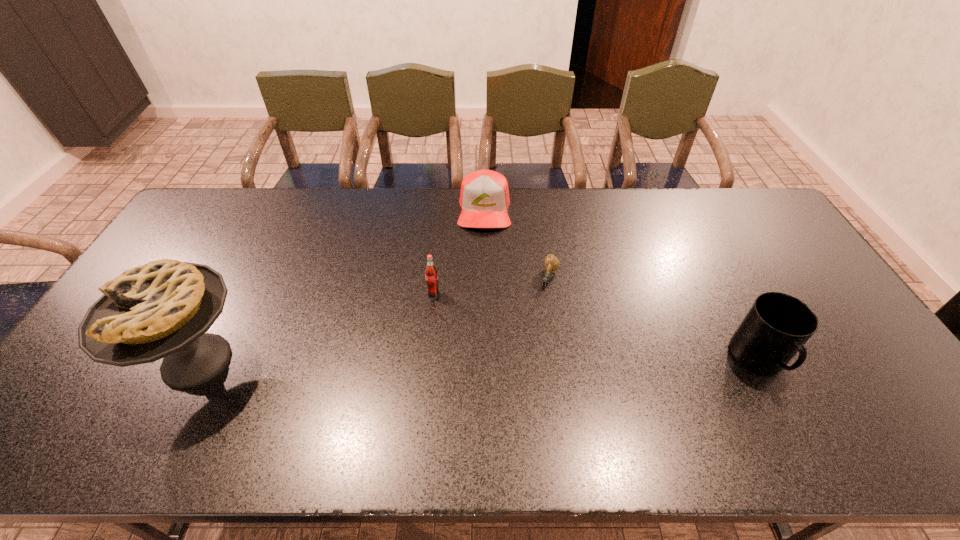
Point out which object is positioned as the nearest to the third object from right to left. Please provide its 2D coordinates. Your answer should be formatted as a tuple, i.e. [(x, y)], where the tuple contains the x and y coordinates of a point satisfying the conditions above.

[(551, 262)]

Identify which object is the nearest to the rightmost object. Please provide its 2D coordinates. Your answer should be formatted as a tuple, i.e. [(x, y)], where the tuple contains the x and y coordinates of a point satisfying the conditions above.

[(551, 262)]

Identify the location of free space that satisfies the following two spatial constraints: 1. on the back side of the escargot; 2. on the left side of the second object from left to right. This screenshot has height=540, width=960. (436, 278).

Find the location of `vacant space that satisfies the following two spatial constraints: 1. on the front side of the third object from right to left; 2. on the left side of the shortest object`. vacant space that satisfies the following two spatial constraints: 1. on the front side of the third object from right to left; 2. on the left side of the shortest object is located at coordinates (485, 278).